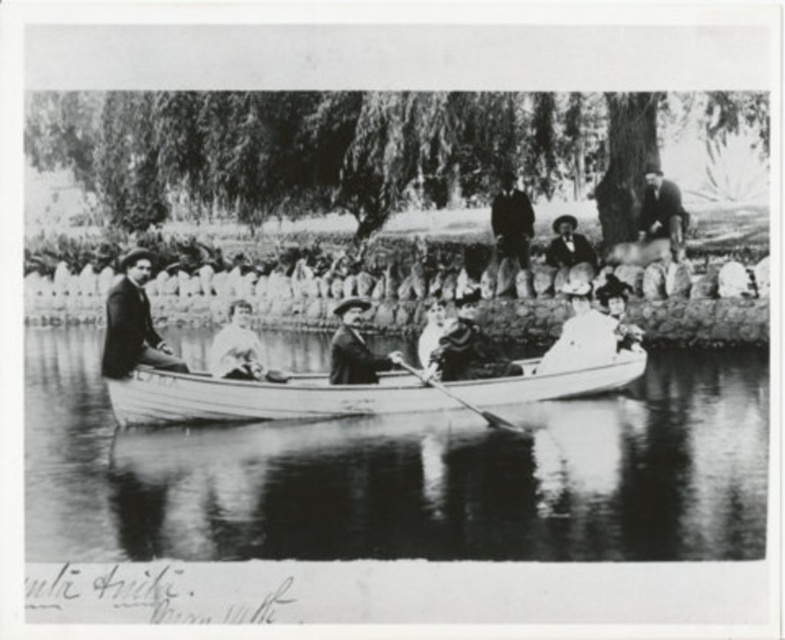
Based on the scene description, where is the smooth white water at center located in the image?

The smooth white water at center is located at point (404, 474) in the image.

You are a photographer standing at the edge of the water, wanting to capture both the smooth leather hat at center and the smooth leather jacket at upper right in the same frame. Given that your camera has a 50mm lens with a field of view that can capture objects up to 20 meters apart, will you be able to include both items in a single photo?

The smooth leather hat at center and smooth leather jacket at upper right are 23.29 meters apart, which exceeds the camera lens field of view limit of 20 meters. Therefore, you cannot capture both items in a single photo.

You are standing on the dock and want to throw a small pebble to hit both the smooth white water at center and the smooth dark suit at left. Is it possible to do so with one throw?

The smooth white water at center and smooth dark suit at left are 16.03 meters apart from each other, so it is unlikely to hit both with one throw as the distance is too far for a single pebble throw.